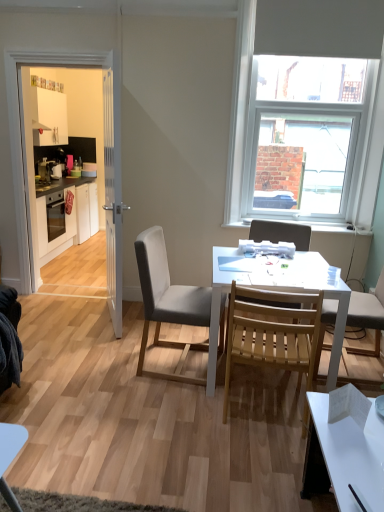
Identify the location of empty space that is ontop of white matte table at center (from a real-world perspective). pos(261,265).